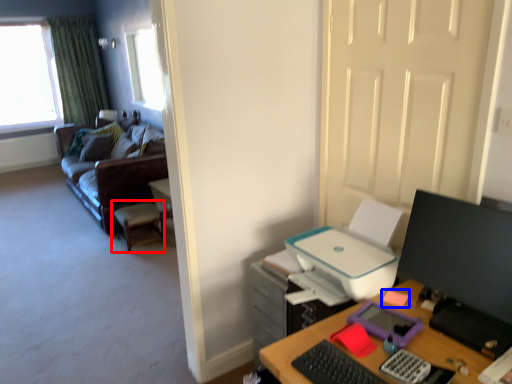
Question: Which object appears closest to the camera in this image, computer chair (highlighted by a red box) or stationery (highlighted by a blue box)?

Choices:
 (A) computer chair
 (B) stationery

Answer: (B)